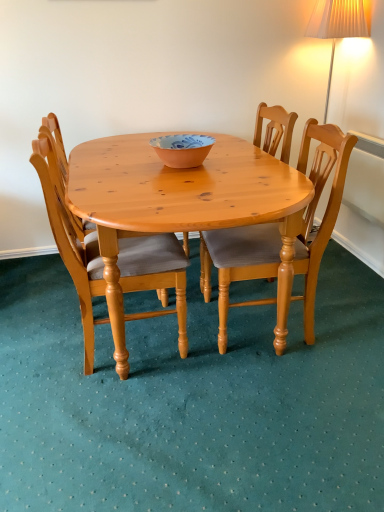
The height and width of the screenshot is (512, 384). I want to click on vacant space in front of pine wood chair at center, which is the third chair from right to left, so click(109, 423).